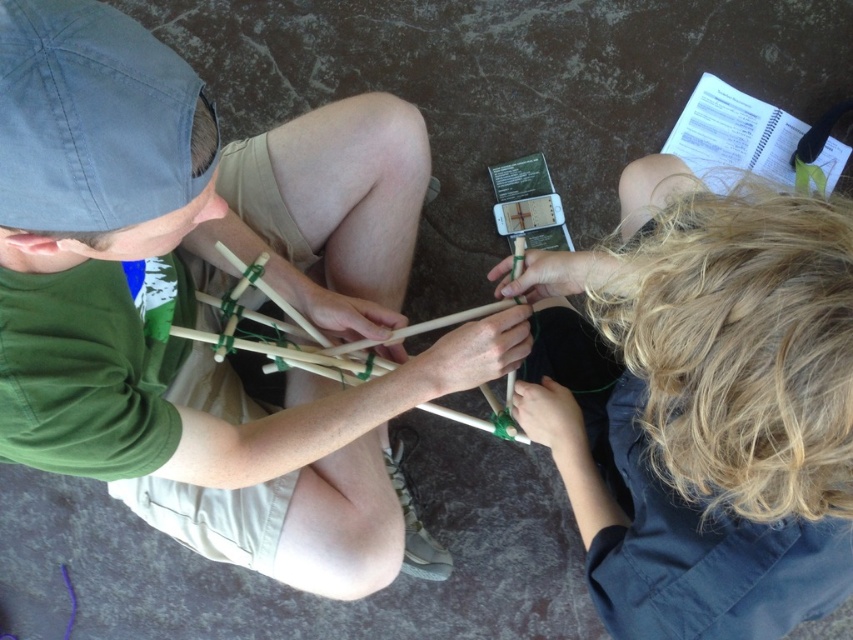
Is smooth wooden sticks at center to the right of blonde hair at upper right from the viewer's perspective?

In fact, smooth wooden sticks at center is to the left of blonde hair at upper right.

Can you confirm if smooth wooden sticks at center is taller than blonde hair at upper right?

Indeed, smooth wooden sticks at center has a greater height compared to blonde hair at upper right.

This screenshot has height=640, width=853. I want to click on smooth wooden sticks at center, so click(x=213, y=292).

This screenshot has width=853, height=640. I want to click on smooth wooden sticks at center, so click(x=213, y=292).